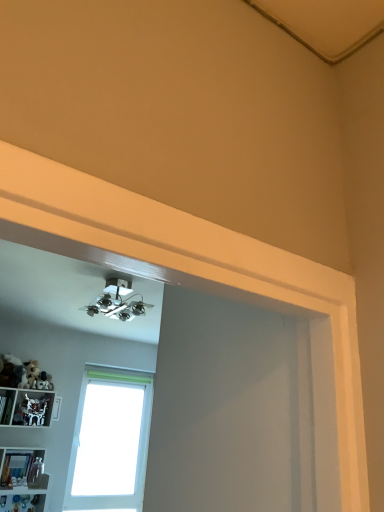
Question: In the image, is translucent plastic bottles at lower left, acting as the first shelf starting from the bottom, positioned in front of or behind white plastic shelf at lower left, arranged as the first shelf when viewed from the top?

Choices:
 (A) behind
 (B) front

Answer: (B)

Question: In terms of size, does translucent plastic bottles at lower left, acting as the first shelf starting from the bottom, appear bigger or smaller than white plastic shelf at lower left, arranged as the first shelf when viewed from the top?

Choices:
 (A) small
 (B) big

Answer: (A)

Question: Estimate the real-world distances between objects in this image. Which object is farther from the white plastic shelf at lower left, which is the second shelf from bottom to top?

Choices:
 (A) white frosted glass window at center
 (B) translucent plastic bottles at lower left, acting as the first shelf starting from the bottom

Answer: (A)

Question: Based on their relative distances, which object is nearer to the white plastic shelf at lower left, which is the second shelf from bottom to top?

Choices:
 (A) white frosted glass window at center
 (B) translucent plastic bottles at lower left, acting as the first shelf starting from the bottom

Answer: (B)